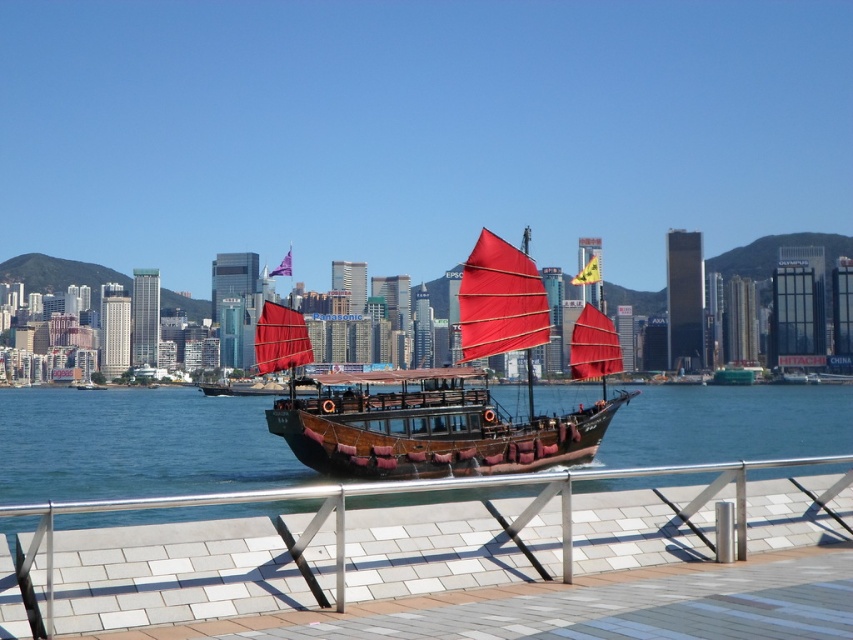
You are standing on the walkway and want to take a photo of the wooden boat at center. Since the transparent blue water at center is in the way, can you adjust your angle to avoid it?

The transparent blue water at center is below the wooden boat at center, so you can take the photo from above the wooden boat at center to avoid the water.

You are standing on the white tile dock at lower center and want to jump into the transparent blue water at center. Is the dock above the water?

Yes, the white tile dock at lower center is above the transparent blue water at center, so you can jump from the dock into the water.